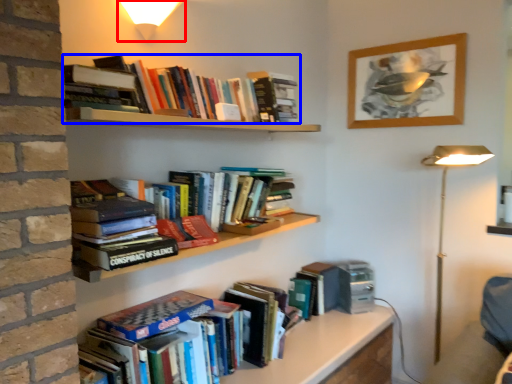
Question: Among these objects, which one is nearest to the camera, light fixture (highlighted by a red box) or book (highlighted by a blue box)?

Choices:
 (A) light fixture
 (B) book

Answer: (A)